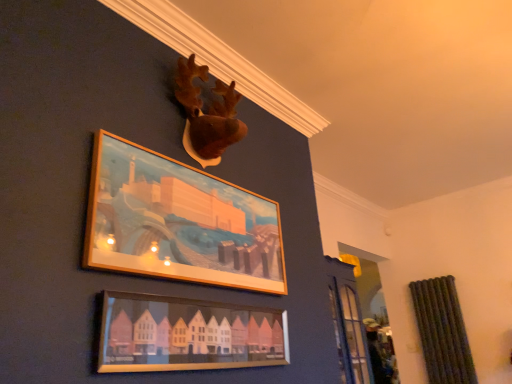
How much space does matte wooden picture frame at lower center, which ranks as the first picture frame in bottom-to-top order, occupy vertically?

matte wooden picture frame at lower center, which ranks as the first picture frame in bottom-to-top order, is 9.70 inches in height.

Describe the element at coordinates (178, 222) in the screenshot. I see `wooden frame at upper center, the 2th picture frame ordered from the bottom` at that location.

Find the location of `matte wooden picture frame at lower center, which ranks as the first picture frame in bottom-to-top order`. matte wooden picture frame at lower center, which ranks as the first picture frame in bottom-to-top order is located at coordinates (187, 335).

From the image's perspective, relative to brown plush moose head at upper center, is wooden frame at upper center, acting as the first picture frame starting from the top, above or below?

Clearly, from the image's perspective, wooden frame at upper center, acting as the first picture frame starting from the top, is below brown plush moose head at upper center.

Considering the relative positions of wooden frame at upper center, the 2th picture frame ordered from the bottom, and brown plush moose head at upper center in the image provided, is wooden frame at upper center, the 2th picture frame ordered from the bottom, to the left of brown plush moose head at upper center from the viewer's perspective?

Correct, you'll find wooden frame at upper center, the 2th picture frame ordered from the bottom, to the left of brown plush moose head at upper center.

Considering the relative positions of brown plush moose head at upper center and matte wooden picture frame at lower center, which appears as the 2th picture frame when viewed from the top, in the image provided, is brown plush moose head at upper center to the right of matte wooden picture frame at lower center, which appears as the 2th picture frame when viewed from the top, from the viewer's perspective?

No, brown plush moose head at upper center is not to the right of matte wooden picture frame at lower center, which appears as the 2th picture frame when viewed from the top.

Considering the sizes of brown plush moose head at upper center and matte wooden picture frame at lower center, which ranks as the first picture frame in bottom-to-top order, in the image, is brown plush moose head at upper center bigger or smaller than matte wooden picture frame at lower center, which ranks as the first picture frame in bottom-to-top order,?

Clearly, brown plush moose head at upper center is larger in size than matte wooden picture frame at lower center, which ranks as the first picture frame in bottom-to-top order.

Can you tell me how much brown plush moose head at upper center and matte wooden picture frame at lower center, which appears as the 2th picture frame when viewed from the top, differ in facing direction?

1 degrees.

Considering their positions, is brown plush moose head at upper center located in front of or behind matte wooden picture frame at lower center, which appears as the 2th picture frame when viewed from the top?

Visually, brown plush moose head at upper center is located behind matte wooden picture frame at lower center, which appears as the 2th picture frame when viewed from the top.

Image resolution: width=512 pixels, height=384 pixels. I want to click on picture frame on the right side of wooden frame at upper center, the 2th picture frame ordered from the bottom, so click(187, 335).

Relative to matte wooden picture frame at lower center, which appears as the 2th picture frame when viewed from the top, is wooden frame at upper center, the 2th picture frame ordered from the bottom, in front or behind?

In the image, wooden frame at upper center, the 2th picture frame ordered from the bottom, appears behind matte wooden picture frame at lower center, which appears as the 2th picture frame when viewed from the top.

From a real-world perspective, who is located lower, wooden frame at upper center, the 2th picture frame ordered from the bottom, or matte wooden picture frame at lower center, which appears as the 2th picture frame when viewed from the top?

In real-world perspective, matte wooden picture frame at lower center, which appears as the 2th picture frame when viewed from the top, is lower.

Is brown plush moose head at upper center shorter than wooden frame at upper center, the 2th picture frame ordered from the bottom?

Yes.

Is brown plush moose head at upper center positioned far away from wooden frame at upper center, the 2th picture frame ordered from the bottom?

They are positioned close to each other.

Which is more to the right, brown plush moose head at upper center or wooden frame at upper center, acting as the first picture frame starting from the top?

Positioned to the right is brown plush moose head at upper center.

Does brown plush moose head at upper center come in front of wooden frame at upper center, acting as the first picture frame starting from the top?

That is False.

How far apart are matte wooden picture frame at lower center, which appears as the 2th picture frame when viewed from the top, and brown plush moose head at upper center?

matte wooden picture frame at lower center, which appears as the 2th picture frame when viewed from the top, is 29.64 inches from brown plush moose head at upper center.

From the image's perspective, which is below, matte wooden picture frame at lower center, which appears as the 2th picture frame when viewed from the top, or brown plush moose head at upper center?

matte wooden picture frame at lower center, which appears as the 2th picture frame when viewed from the top, from the image's perspective.

Would you say brown plush moose head at upper center is part of matte wooden picture frame at lower center, which appears as the 2th picture frame when viewed from the top,'s contents?

No, brown plush moose head at upper center is located outside of matte wooden picture frame at lower center, which appears as the 2th picture frame when viewed from the top.

Considering the relative sizes of matte wooden picture frame at lower center, which ranks as the first picture frame in bottom-to-top order, and brown plush moose head at upper center in the image provided, is matte wooden picture frame at lower center, which ranks as the first picture frame in bottom-to-top order, smaller than brown plush moose head at upper center?

Correct, matte wooden picture frame at lower center, which ranks as the first picture frame in bottom-to-top order, occupies less space than brown plush moose head at upper center.

Is matte wooden picture frame at lower center, which ranks as the first picture frame in bottom-to-top order, taller than wooden frame at upper center, the 2th picture frame ordered from the bottom?

No.

Is point (98, 362) farther from camera compared to point (160, 241)?

That is False.

This screenshot has width=512, height=384. I want to click on animal that is above the wooden frame at upper center, the 2th picture frame ordered from the bottom (from the image's perspective), so click(x=207, y=114).

From the image's perspective, which picture frame is the 2nd one below the brown plush moose head at upper center? Please provide its 2D coordinates.

[(187, 335)]

Estimate the real-world distances between objects in this image. Which object is further from wooden frame at upper center, acting as the first picture frame starting from the top, brown plush moose head at upper center or matte wooden picture frame at lower center, which ranks as the first picture frame in bottom-to-top order?

brown plush moose head at upper center.

Which object lies nearer to the anchor point matte wooden picture frame at lower center, which ranks as the first picture frame in bottom-to-top order, wooden frame at upper center, acting as the first picture frame starting from the top, or brown plush moose head at upper center?

wooden frame at upper center, acting as the first picture frame starting from the top, is closer to matte wooden picture frame at lower center, which ranks as the first picture frame in bottom-to-top order.

Considering their positions, is wooden frame at upper center, acting as the first picture frame starting from the top, positioned further to brown plush moose head at upper center than matte wooden picture frame at lower center, which appears as the 2th picture frame when viewed from the top?

Among the two, matte wooden picture frame at lower center, which appears as the 2th picture frame when viewed from the top, is located further to brown plush moose head at upper center.

Based on the photo, when comparing their distances from matte wooden picture frame at lower center, which ranks as the first picture frame in bottom-to-top order, does brown plush moose head at upper center or wooden frame at upper center, the 2th picture frame ordered from the bottom, seem further?

The object further to matte wooden picture frame at lower center, which ranks as the first picture frame in bottom-to-top order, is brown plush moose head at upper center.

From the image, which object appears to be farther from wooden frame at upper center, the 2th picture frame ordered from the bottom, matte wooden picture frame at lower center, which ranks as the first picture frame in bottom-to-top order, or brown plush moose head at upper center?

brown plush moose head at upper center.

Based on their spatial positions, is matte wooden picture frame at lower center, which ranks as the first picture frame in bottom-to-top order, or wooden frame at upper center, the 2th picture frame ordered from the bottom, further from brown plush moose head at upper center?

Based on the image, matte wooden picture frame at lower center, which ranks as the first picture frame in bottom-to-top order, appears to be further to brown plush moose head at upper center.

This screenshot has width=512, height=384. Find the location of `picture frame between brown plush moose head at upper center and matte wooden picture frame at lower center, which appears as the 2th picture frame when viewed from the top, in the vertical direction`. picture frame between brown plush moose head at upper center and matte wooden picture frame at lower center, which appears as the 2th picture frame when viewed from the top, in the vertical direction is located at coordinates (178, 222).